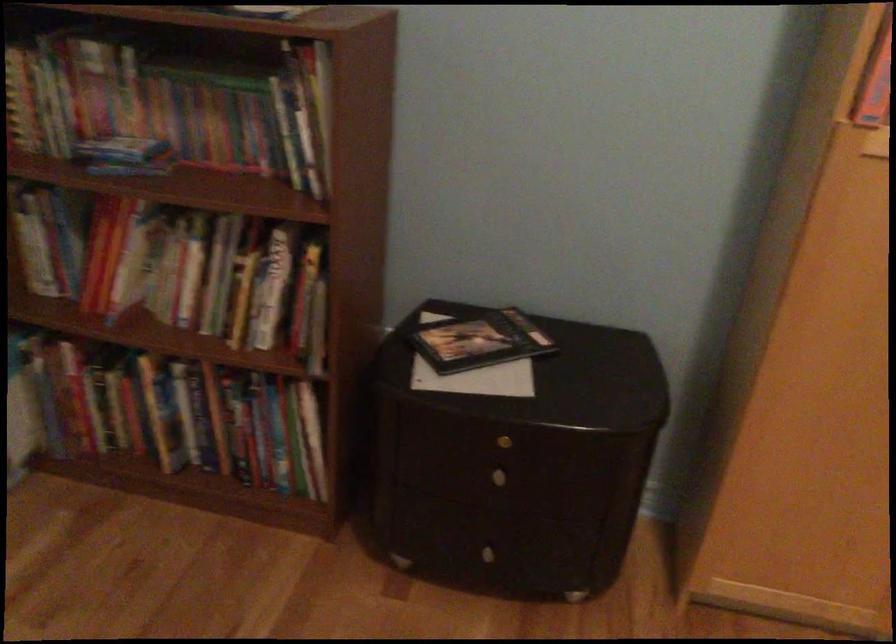
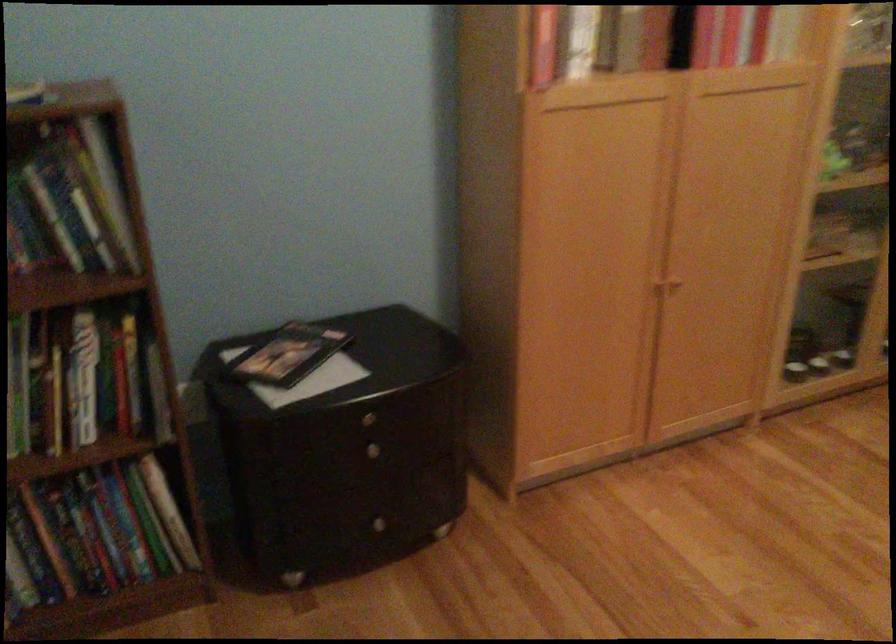
Question: The first image is from the beginning of the video and the second image is from the end. How did the camera likely rotate when shooting the video?

Choices:
 (A) Left
 (B) Right
 (C) Up
 (D) Down

Answer: (B)